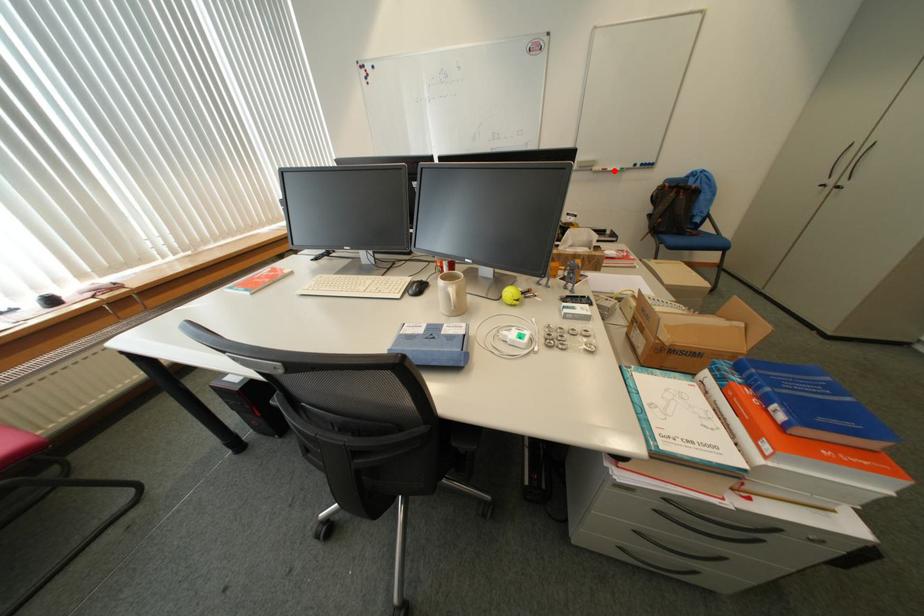
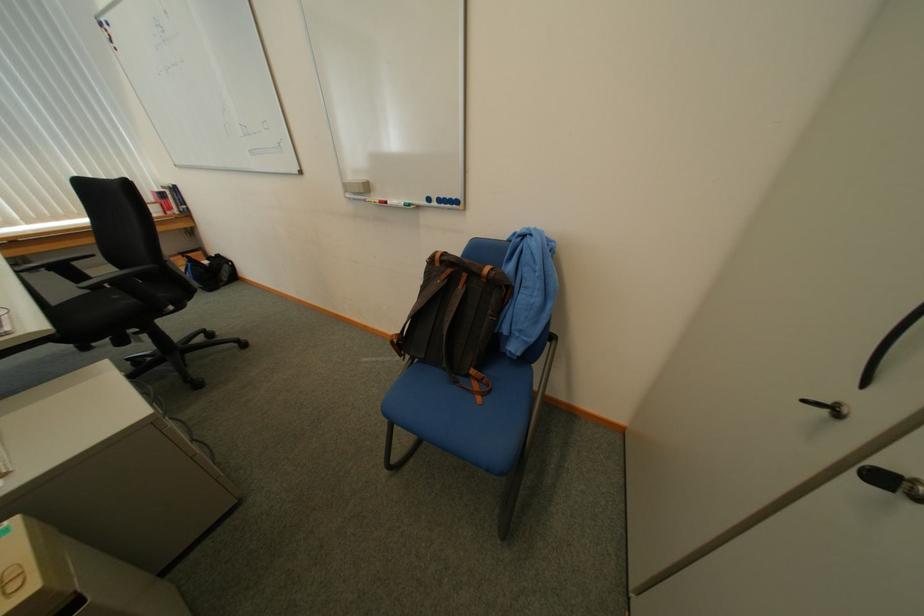
Locate, in the second image, the point that corresponds to the highlighted location in the first image.

(396, 204)